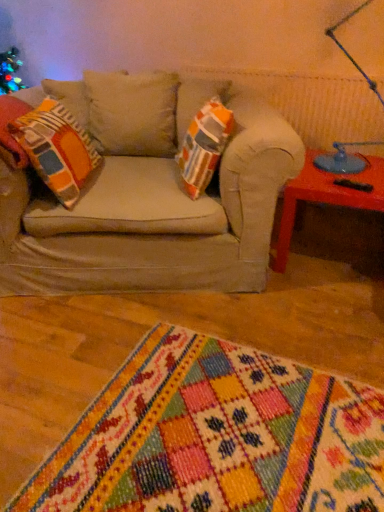
This screenshot has width=384, height=512. What are the coordinates of `vacant space underneath matte orange table at right (from a real-world perspective)` in the screenshot? It's located at (330, 256).